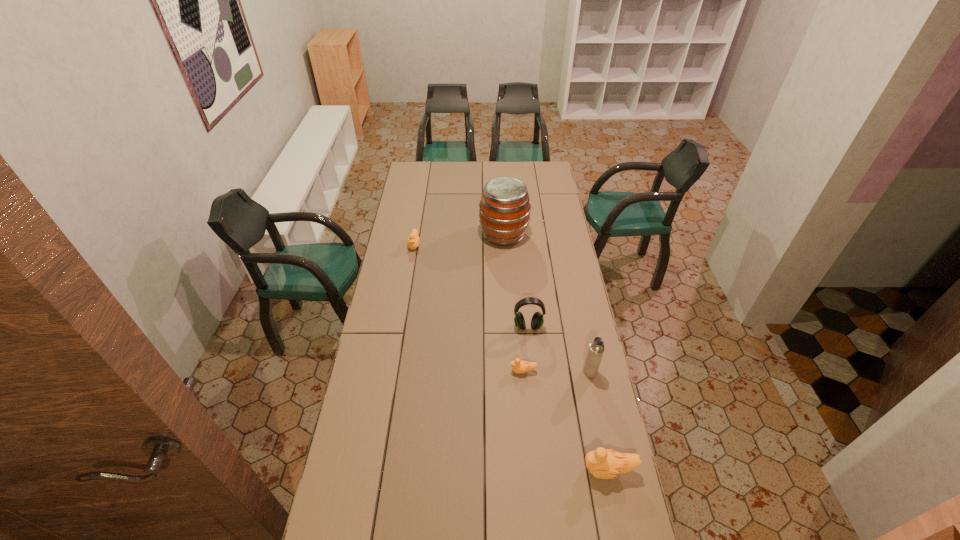
Locate which duckling ranks in proximity to the thermos bottle. Please provide its 2D coordinates. Your answer should be formatted as a tuple, i.e. [(x, y)], where the tuple contains the x and y coordinates of a point satisfying the conditions above.

[(518, 366)]

Identify the location of duckling that is the third closest to the fourth shortest object. The image size is (960, 540). (413, 240).

Where is `vacant region that satisfies the following two spatial constraints: 1. on the face of the second duckling from right to left; 2. on the left side of the thermos bottle`? This screenshot has width=960, height=540. vacant region that satisfies the following two spatial constraints: 1. on the face of the second duckling from right to left; 2. on the left side of the thermos bottle is located at coordinates (523, 372).

The height and width of the screenshot is (540, 960). In order to click on vacant region that satisfies the following two spatial constraints: 1. on the ear cups of the fourth shortest object; 2. on the left side of the thermos bottle in this screenshot , I will do `click(533, 372)`.

Where is `free location that satisfies the following two spatial constraints: 1. on the ear cups of the third tallest object; 2. on the face of the second duckling from right to left`? This screenshot has height=540, width=960. free location that satisfies the following two spatial constraints: 1. on the ear cups of the third tallest object; 2. on the face of the second duckling from right to left is located at coordinates (533, 371).

This screenshot has width=960, height=540. I want to click on blank area in the image that satisfies the following two spatial constraints: 1. on the ear cups of the thermos bottle; 2. on the right side of the fourth nearest object, so [533, 372].